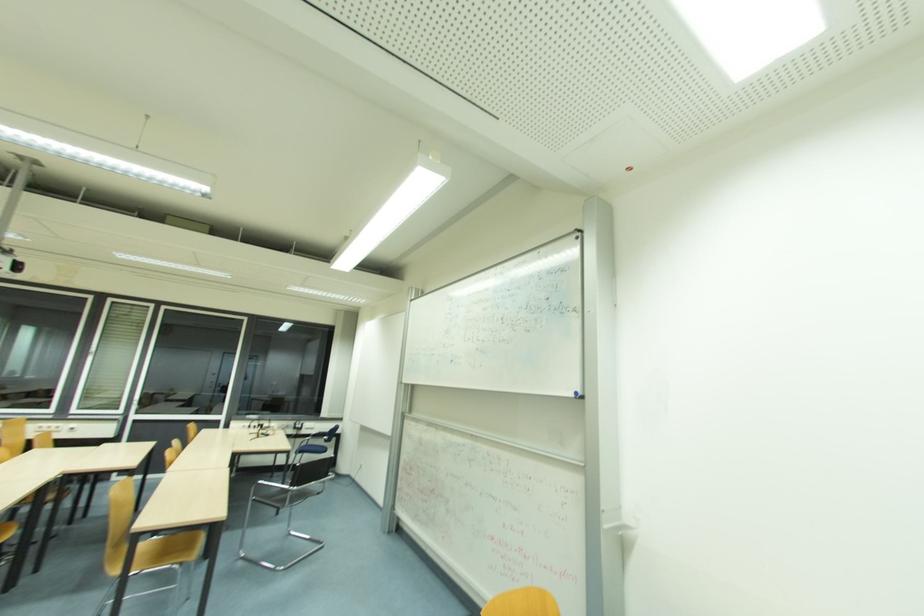
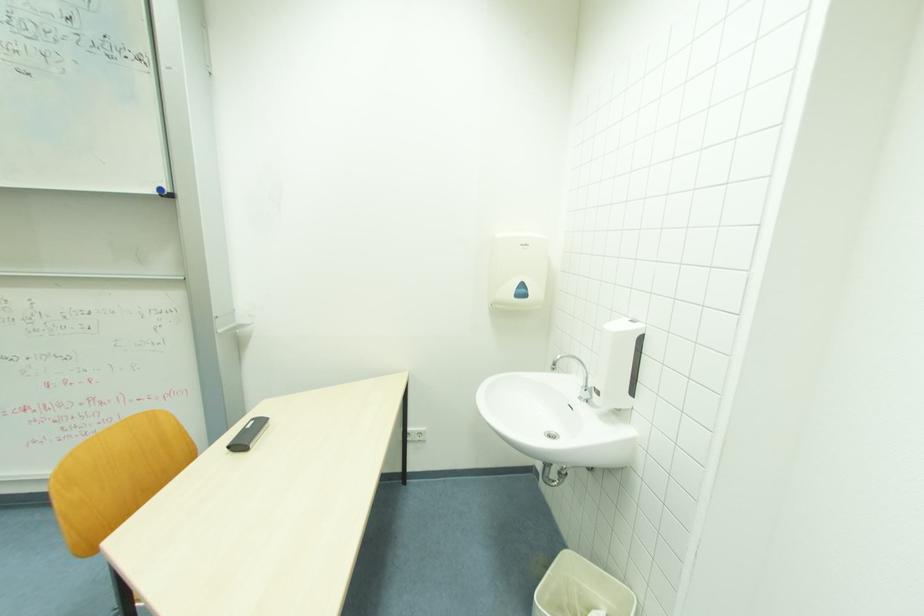
How did the camera likely rotate?

The rotation direction of the camera is right-down.